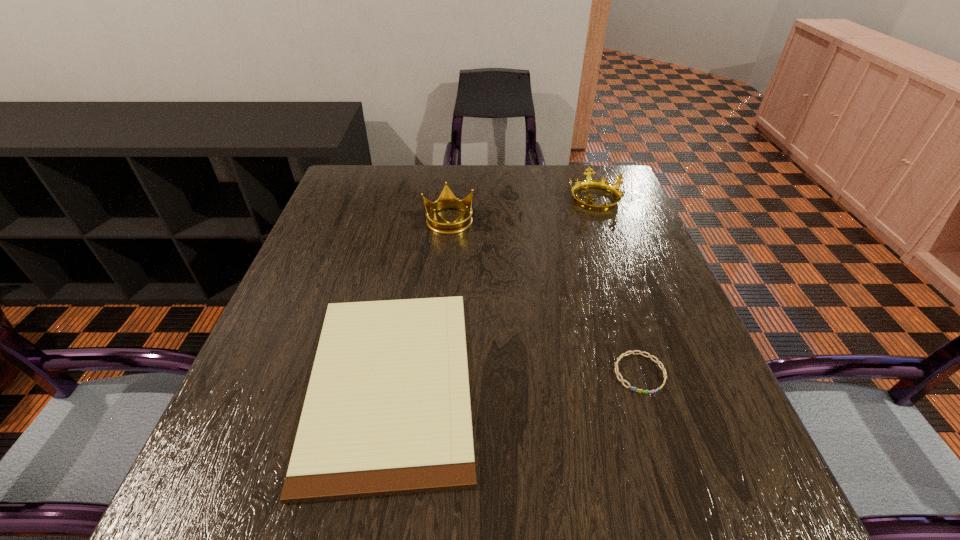
The width and height of the screenshot is (960, 540). Identify the location of the taller crown. (446, 200).

The image size is (960, 540). I want to click on the tallest object, so click(x=446, y=200).

Image resolution: width=960 pixels, height=540 pixels. I want to click on the shorter crown, so click(588, 182).

Where is `the right crown`? The width and height of the screenshot is (960, 540). the right crown is located at coordinates (588, 182).

This screenshot has width=960, height=540. I want to click on bracelet, so click(631, 352).

I want to click on clipboard, so click(x=387, y=411).

At what (x,y) coordinates should I click in order to perform the action: click on free point located 0.070m on the back of the tallest object. Please return your answer as a coordinate pair (x, y). This screenshot has height=540, width=960. Looking at the image, I should click on (451, 193).

The height and width of the screenshot is (540, 960). Find the location of `free spot located 0.250m on the front of the second tallest object`. free spot located 0.250m on the front of the second tallest object is located at coordinates (621, 274).

At what (x,y) coordinates should I click in order to perform the action: click on free location located on the surface of the bracelet showing star-shaped elements. Please return your answer as a coordinate pair (x, y). Looking at the image, I should click on 689,528.

At what (x,y) coordinates should I click in order to perform the action: click on vacant area situated 0.250m on the right of the clipboard. Please return your answer as a coordinate pair (x, y). This screenshot has width=960, height=540. Looking at the image, I should click on (612, 382).